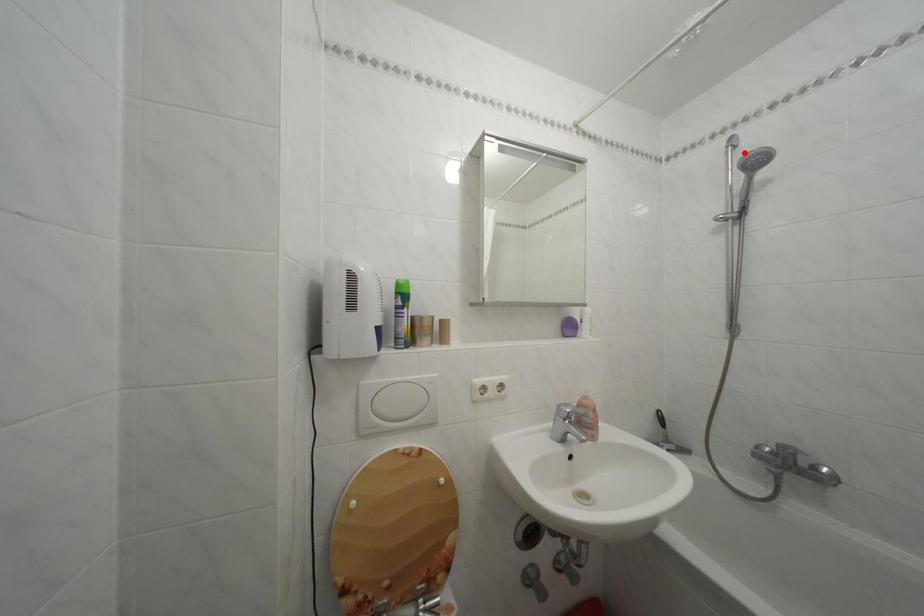
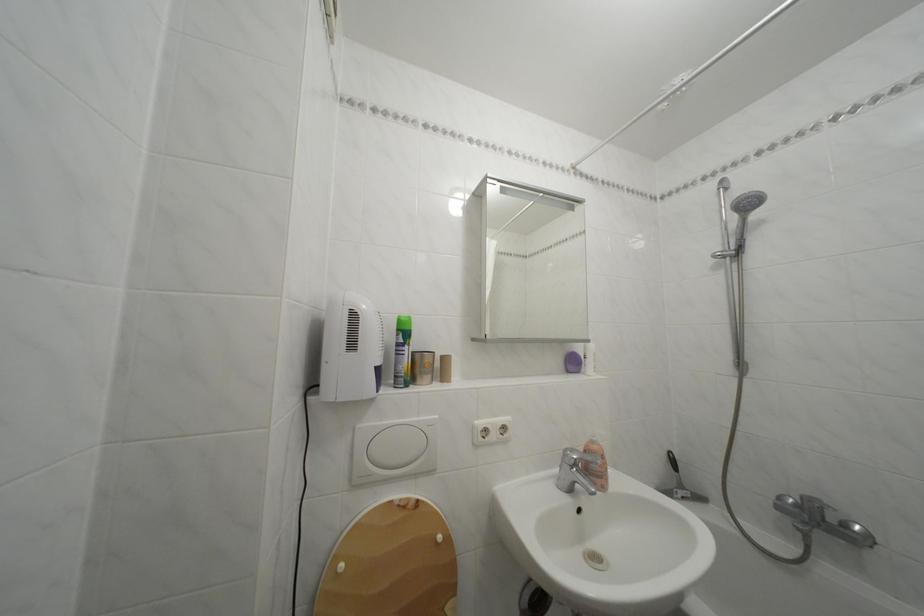
Locate, in the second image, the point that corresponds to the highlighted location in the first image.

(736, 195)